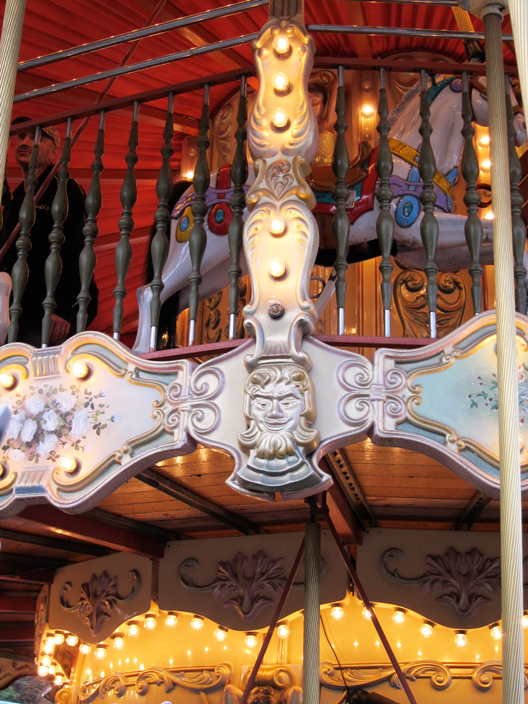
What are the coordinates of `lighting bottom floor` in the screenshot? It's located at (247, 641), (423, 629), (146, 624).